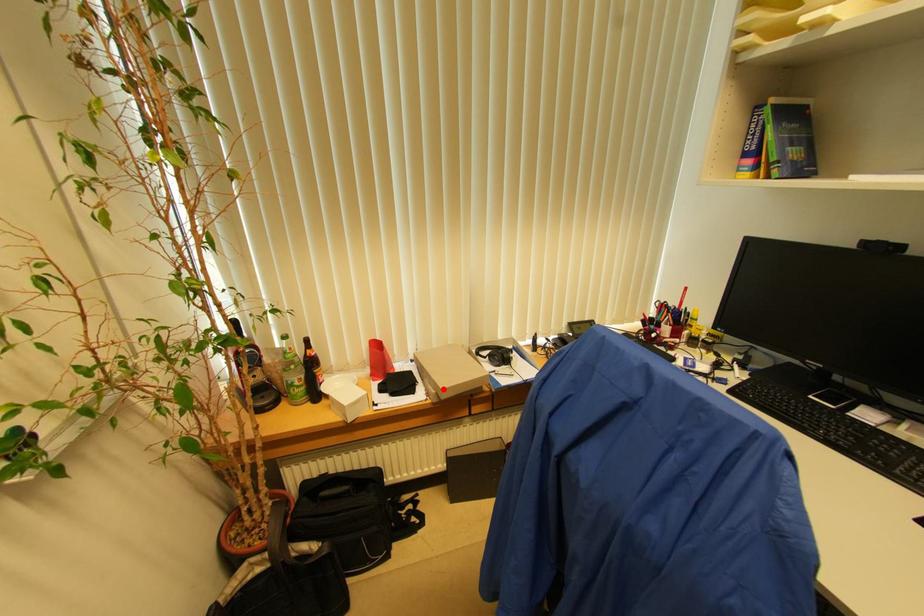
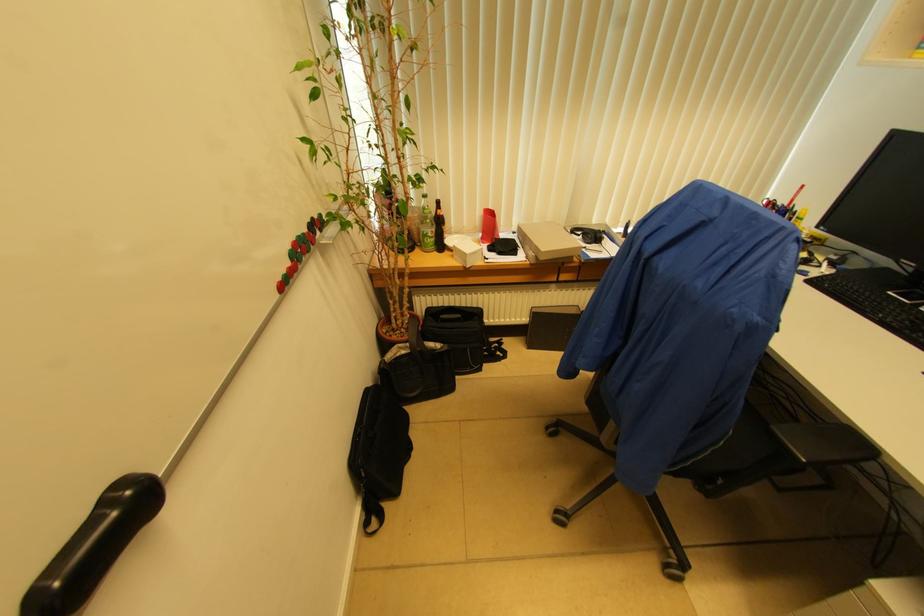
Question: I am providing you with two images of the same scene from different viewpoints. Image1 has a red point marked. In image2, the corresponding 3D location appears at what relative position? Reply with the corresponding letter.

Choices:
 (A) Closer
 (B) Farther

Answer: (A)